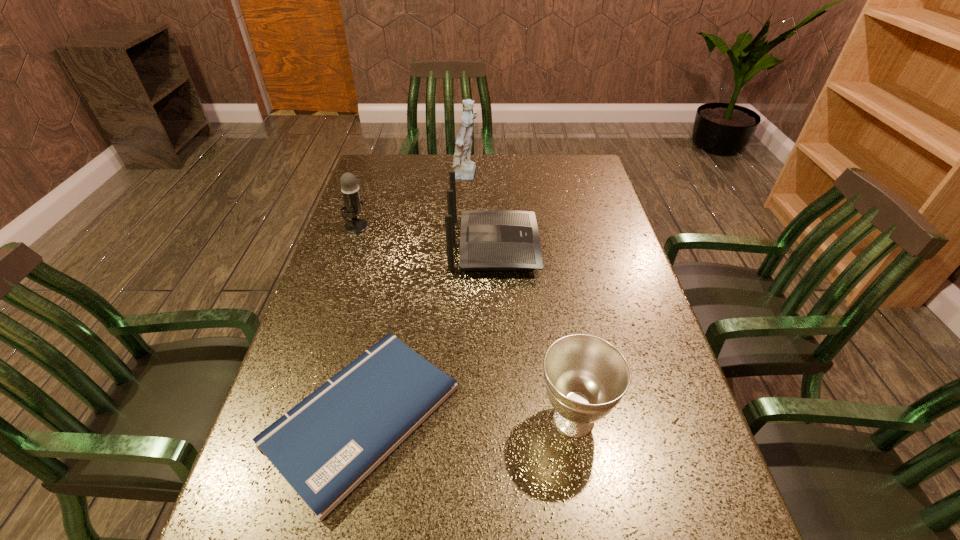
Locate an element on the screen. blank region between the farthest object and the chalice is located at coordinates (520, 298).

Image resolution: width=960 pixels, height=540 pixels. I want to click on free space that is in between the microphone and the paperback book, so click(359, 321).

This screenshot has width=960, height=540. In order to click on vacant space in between the microphone and the chalice in this screenshot , I will do `click(465, 322)`.

You are a GUI agent. You are given a task and a screenshot of the screen. Output one action in this format:
    pyautogui.click(x=<x>, y=<y>)
    Task: Click on the empty space that is in between the chalice and the router
    Image resolution: width=960 pixels, height=540 pixels.
    Given the screenshot: What is the action you would take?
    pyautogui.click(x=534, y=333)

In order to click on free spot between the farthest object and the paperback book in this screenshot , I will do `click(415, 296)`.

I want to click on vacant space in between the paperback book and the router, so click(x=428, y=331).

This screenshot has width=960, height=540. What are the coordinates of `unoccupied position between the chalice and the paperback book` in the screenshot? It's located at (468, 417).

Where is `object identified as the third closest to the figurine`? The width and height of the screenshot is (960, 540). object identified as the third closest to the figurine is located at coordinates (325, 446).

Locate an element on the screen. The width and height of the screenshot is (960, 540). object that is the third closest to the farthest object is located at coordinates (325, 446).

I want to click on vacant area in the image that satisfies the following two spatial constraints: 1. on the back side of the shortest object; 2. on the front-facing side of the router, so click(x=398, y=246).